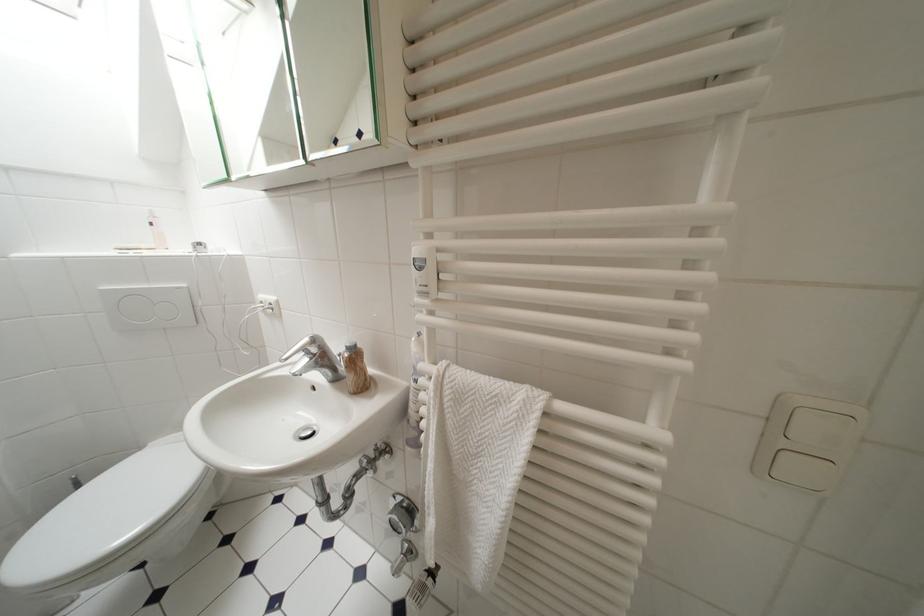
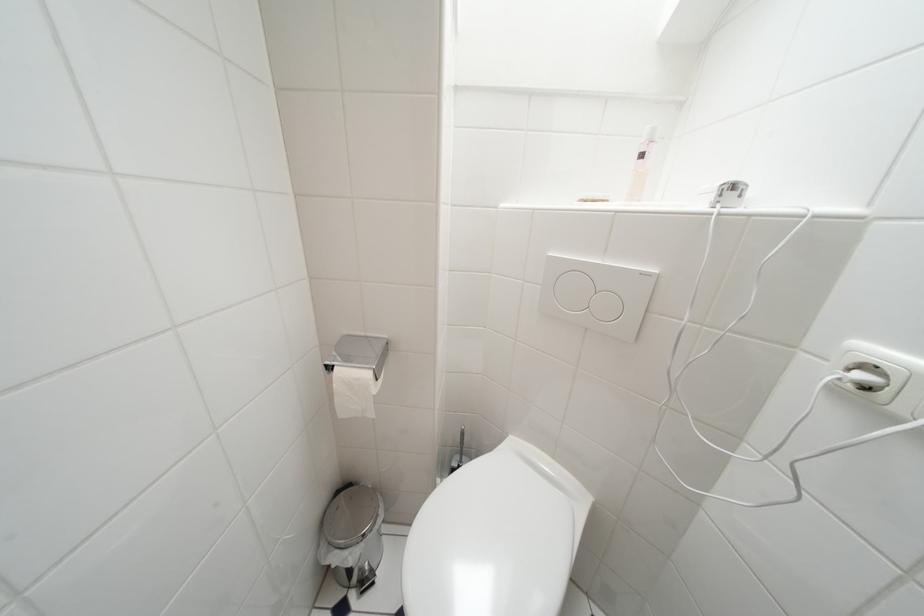
Question: The camera is either moving clockwise (left) or counter-clockwise (right) around the object. The first image is from the beginning of the video and the second image is from the end. Is the camera moving left or right when shooting the video?

Choices:
 (A) Left
 (B) Right

Answer: (B)